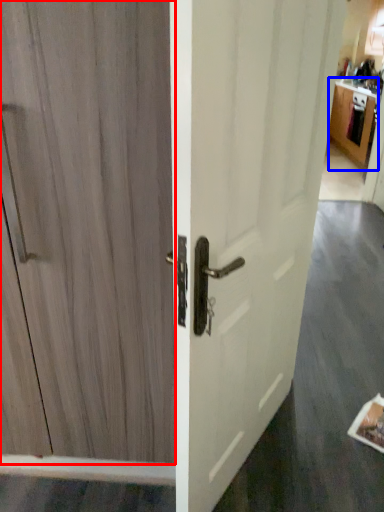
Question: Which object appears closest to the camera in this image, door (highlighted by a red box) or cabinetry (highlighted by a blue box)?

Choices:
 (A) door
 (B) cabinetry

Answer: (A)